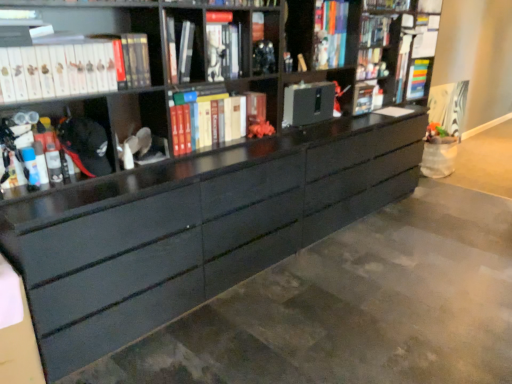
Question: Which direction should I rotate to face black matte cabinet at center, acting as the 2th cabinet starting from the left, — up or down?

Choices:
 (A) down
 (B) up

Answer: (B)

Question: Are black matte cabinet at center, which ranks as the 2th cabinet in front-to-back order, and white matte book at upper left, the 5th book when ordered from back to front, located far from each other?

Choices:
 (A) yes
 (B) no

Answer: (A)

Question: Does black matte cabinet at center, which appears as the 1th cabinet when viewed from the back, come behind white matte book at upper left, which ranks as the 2th book in left-to-right order?

Choices:
 (A) yes
 (B) no

Answer: (A)

Question: Is black matte cabinet at center, marked as the first cabinet in a right-to-left arrangement, bigger than white matte book at upper left, the 1th book positioned from the front?

Choices:
 (A) no
 (B) yes

Answer: (A)

Question: Is black matte cabinet at center, which appears as the 1th cabinet when viewed from the back, to the right of white matte book at upper left, which ranks as the 2th book in left-to-right order, from the viewer's perspective?

Choices:
 (A) no
 (B) yes

Answer: (B)

Question: Does black matte cabinet at center, which appears as the 1th cabinet when viewed from the back, turn towards white matte book at upper left, the 1th book positioned from the front?

Choices:
 (A) yes
 (B) no

Answer: (B)

Question: Is black matte cabinet at center, which appears as the 1th cabinet when viewed from the back, oriented away from white matte book at upper left, positioned as the fourth book in right-to-left order?

Choices:
 (A) yes
 (B) no

Answer: (B)

Question: Is the surface of hardcover books at center, arranged as the fourth book when viewed from the left, in direct contact with matte black marker at left, acting as the fifth book starting from the right?

Choices:
 (A) yes
 (B) no

Answer: (B)

Question: From a real-world perspective, is hardcover books at center, acting as the 2th book starting from the back, over matte black marker at left, arranged as the 4th book when viewed from the back?

Choices:
 (A) no
 (B) yes

Answer: (A)

Question: Is hardcover books at center, acting as the 2th book starting from the back, wider than matte black marker at left, arranged as the 4th book when viewed from the back?

Choices:
 (A) yes
 (B) no

Answer: (A)

Question: Does hardcover books at center, the fourth book positioned from the front, have a lesser height compared to matte black marker at left, which is the first book from left to right?

Choices:
 (A) yes
 (B) no

Answer: (A)

Question: From the image's perspective, is hardcover books at center, acting as the 2th book starting from the back, located beneath matte black marker at left, acting as the fifth book starting from the right?

Choices:
 (A) no
 (B) yes

Answer: (A)

Question: Can you confirm if hardcover books at center, acting as the 2th book starting from the right, is thinner than matte black marker at left, the second book viewed from the front?

Choices:
 (A) no
 (B) yes

Answer: (A)

Question: Is matte black marker at left, acting as the fifth book starting from the right, at the left side of multicolored plastic book at upper right, the fifth book in the left-to-right sequence?

Choices:
 (A) yes
 (B) no

Answer: (A)